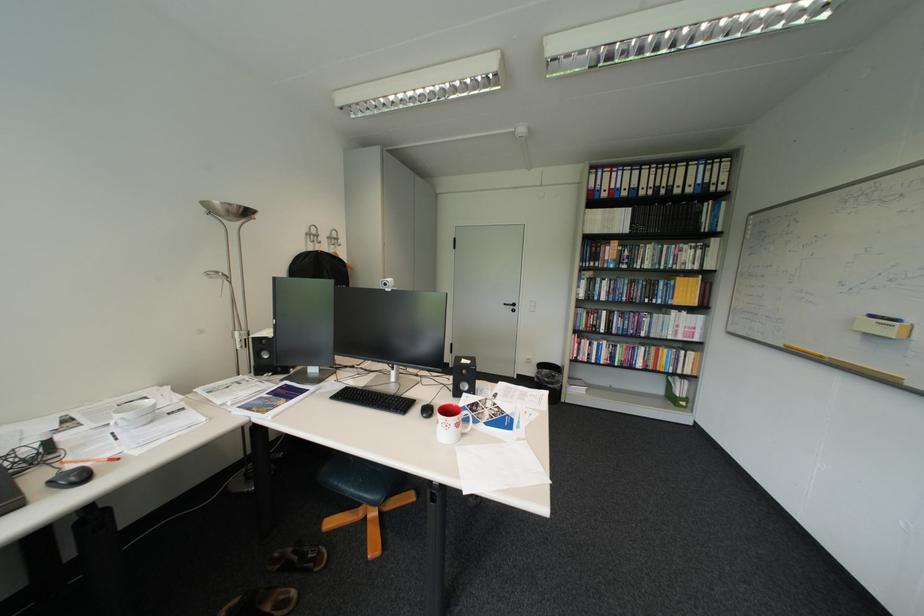
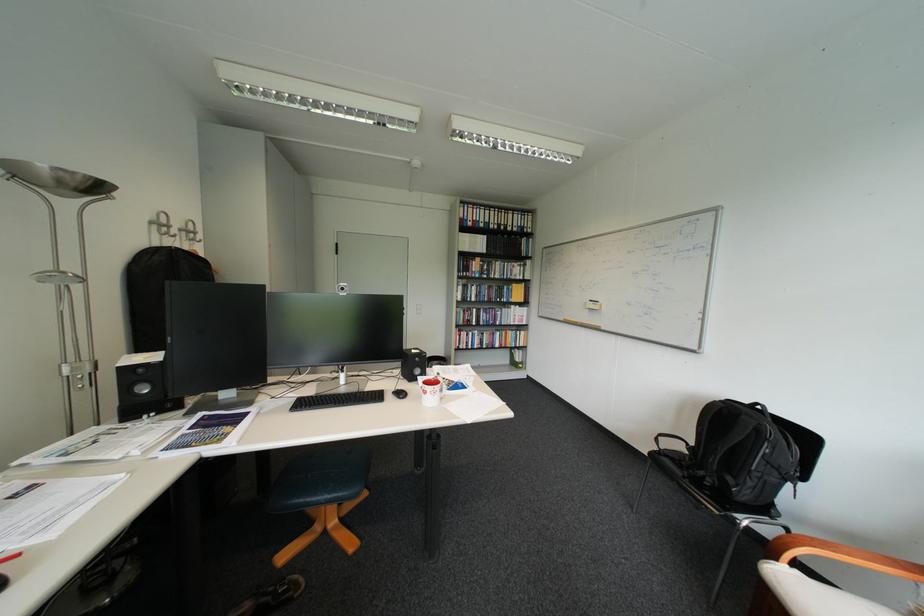
The point at (480,392) is marked in the first image. Where is the corresponding point in the second image?

(432, 376)